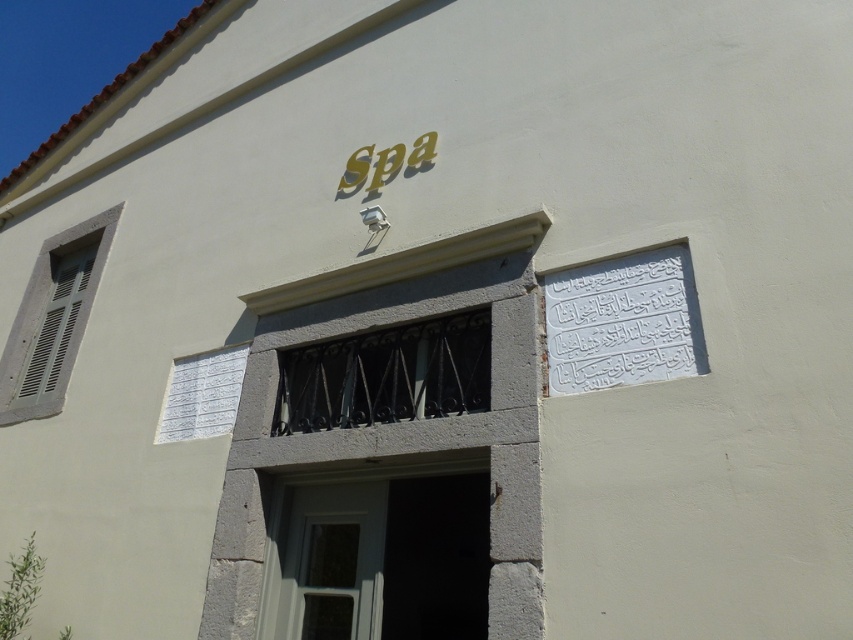
Who is higher up, white painted wood door at center or white carved stone plaque at upper right?

white carved stone plaque at upper right

Is white painted wood door at center positioned before white carved stone plaque at upper right?

No, white painted wood door at center is further to the viewer.

Who is more distant from viewer, (476, 509) or (602, 328)?

Point (476, 509)

In order to click on white painted wood door at center in this screenshot , I will do `click(379, 552)`.